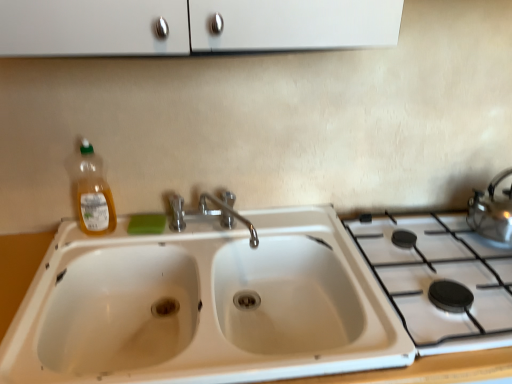
Locate an element on the screen. This screenshot has height=384, width=512. vacant space underneath chrome metallic faucet at center (from a real-world perspective) is located at coordinates (210, 236).